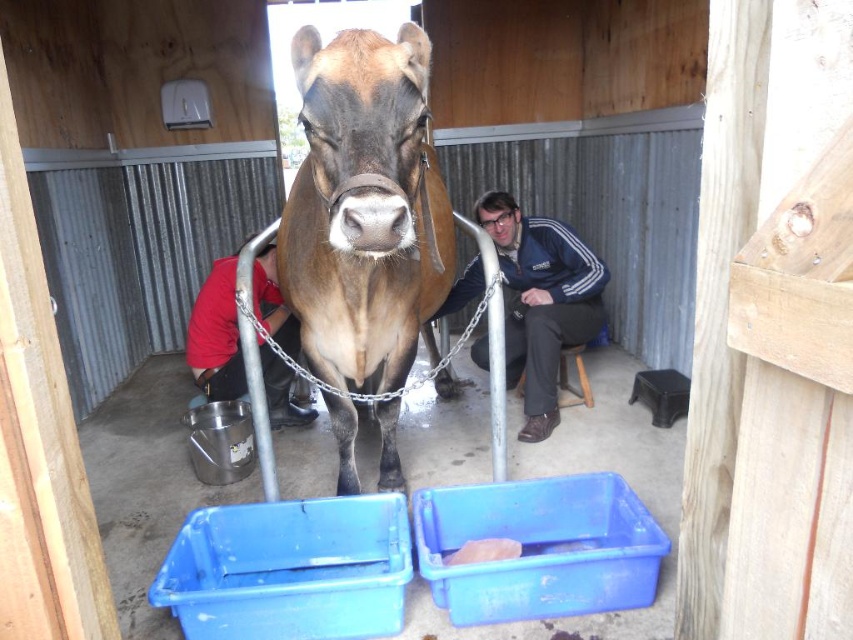
You are a maintenance worker needing to move a 1.2 meter long ladder from the storage area to the work zone. The path between the blue fabric jacket at center and the red shirt at lower left is 1.08 meters. Can the ladder fit through this space without tilting it?

The distance between the blue fabric jacket at center and the red shirt at lower left is 1.08 meters, which is shorter than the ladder length of 1.2 meters. The ladder cannot fit through this space without tilting.